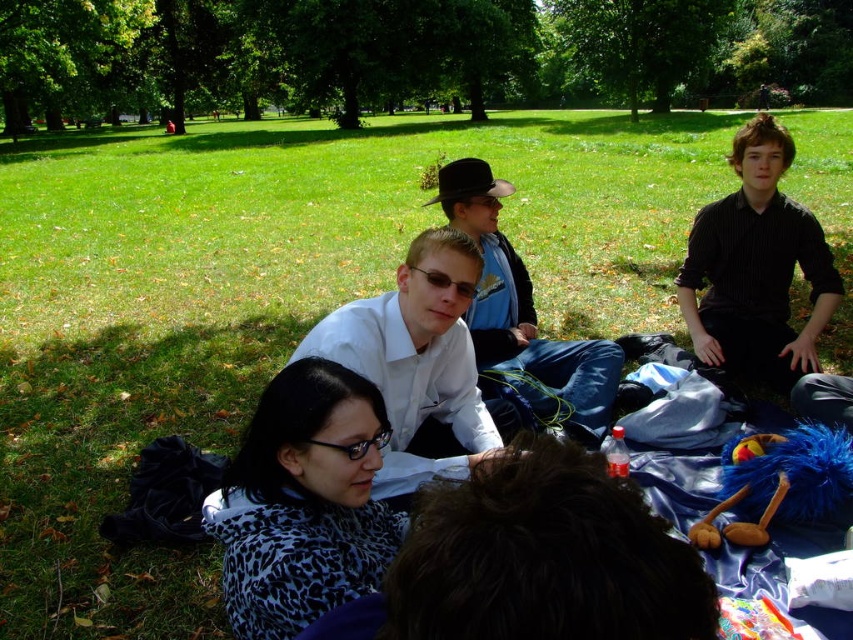
Looking at this image, you are a photographer trying to capture a candid shot of the leopard print coat at lower left and the blue fuzzy plush toy at lower right. Since you want to ensure both subjects are in focus, which one should you focus on first to maintain depth of field? Please explain your reasoning based on their positions.

The leopard print coat at lower left is in front of the blue fuzzy plush toy at lower right. To maintain depth of field, you should focus on the leopard print coat at lower left first since it is closer to the camera. This ensures both the foreground and background elements are in focus.